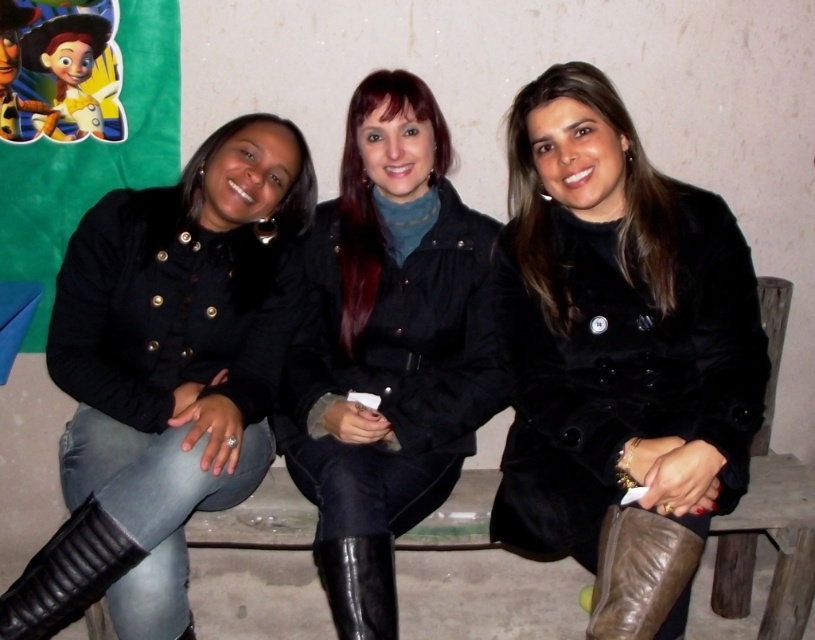
Does point (263, 268) come farther from viewer compared to point (652, 573)?

Yes, it is.

Does point (184, 332) lie in front of point (648, 516)?

No, (184, 332) is further to viewer.

The image size is (815, 640). What do you see at coordinates (166, 372) in the screenshot?
I see `black leather jacket at left` at bounding box center [166, 372].

You are a GUI agent. You are given a task and a screenshot of the screen. Output one action in this format:
    pyautogui.click(x=<x>, y=<y>)
    Task: Click on the black leather jacket at left
    The width and height of the screenshot is (815, 640).
    Given the screenshot: What is the action you would take?
    pyautogui.click(x=166, y=372)

Between black leather boots at center and black leather boot at lower left, which one appears on the left side from the viewer's perspective?

black leather boot at lower left

Does black leather boots at center come behind black leather boot at lower left?

That is False.

At what (x,y) coordinates should I click in order to perform the action: click on black leather boots at center. Please return your answer as a coordinate pair (x, y). This screenshot has width=815, height=640. Looking at the image, I should click on (386, 348).

The width and height of the screenshot is (815, 640). What are the coordinates of `black leather boots at center` in the screenshot? It's located at (386, 348).

Can you confirm if black leather jacket at left is wider than black leather boot at lower center?

Yes, black leather jacket at left is wider than black leather boot at lower center.

Between black leather jacket at left and black leather boot at lower center, which one has less height?

Standing shorter between the two is black leather boot at lower center.

At what (x,y) coordinates should I click in order to perform the action: click on black leather jacket at left. Please return your answer as a coordinate pair (x, y). Looking at the image, I should click on (166, 372).

Locate an element on the screen. The height and width of the screenshot is (640, 815). black leather jacket at left is located at coordinates (166, 372).